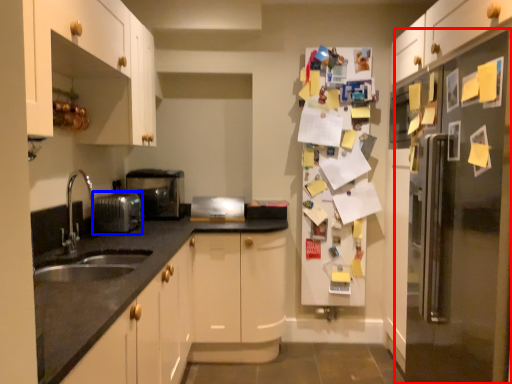
Question: Which object appears closest to the camera in this image, fridge (highlighted by a red box) or appliance (highlighted by a blue box)?

Choices:
 (A) fridge
 (B) appliance

Answer: (A)